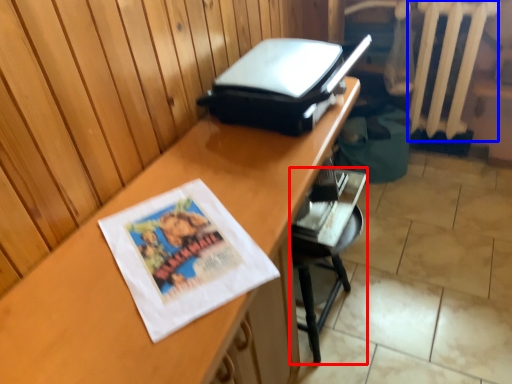
Question: Which object appears farthest to the camera in this image, furniture (highlighted by a red box) or radiator (highlighted by a blue box)?

Choices:
 (A) furniture
 (B) radiator

Answer: (B)